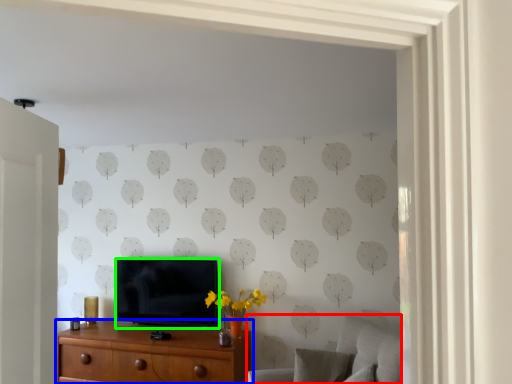
Question: Based on their relative distances, which object is nearer to swivel chair (highlighted by a red box)? Choose from chest of drawers (highlighted by a blue box) and television (highlighted by a green box).

Choices:
 (A) chest of drawers
 (B) television

Answer: (A)